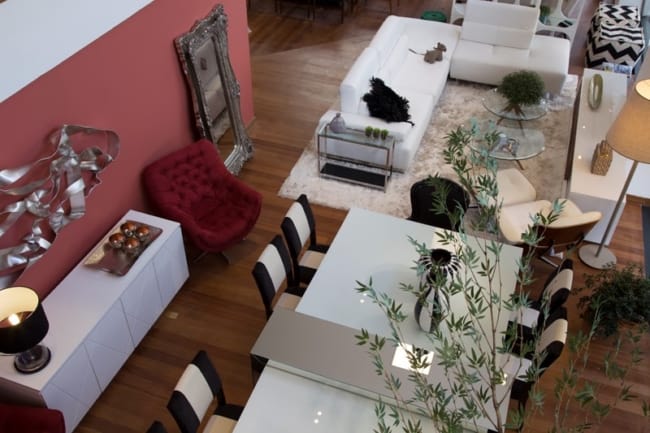
In order to click on white couch in this screenshot , I will do `click(403, 81)`.